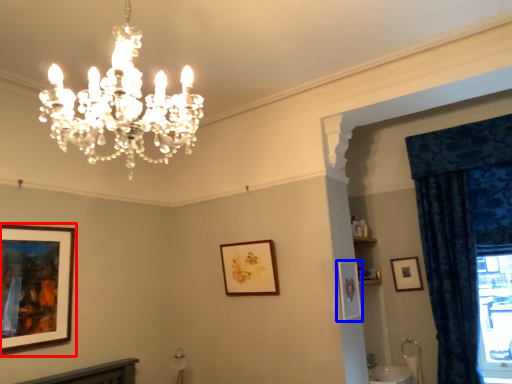
Question: Which point is further to the camera, picture frame (highlighted by a red box) or picture frame (highlighted by a blue box)?

Choices:
 (A) picture frame
 (B) picture frame

Answer: (B)